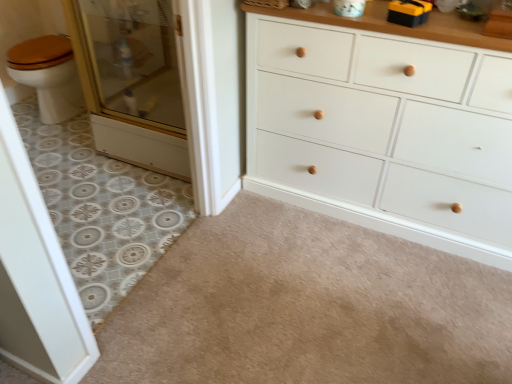
Question: Considering the relative sizes of white painted wood chest of drawers at center and beige carpet at lower center, positioned as the second plain in left-to-right order, in the image provided, is white painted wood chest of drawers at center smaller than beige carpet at lower center, positioned as the second plain in left-to-right order,?

Choices:
 (A) no
 (B) yes

Answer: (A)

Question: Can you confirm if white painted wood chest of drawers at center is thinner than beige carpet at lower center, positioned as the second plain in left-to-right order?

Choices:
 (A) no
 (B) yes

Answer: (B)

Question: Would you say white painted wood chest of drawers at center is outside beige carpet at lower center, positioned as the second plain in left-to-right order?

Choices:
 (A) yes
 (B) no

Answer: (A)

Question: Is white painted wood chest of drawers at center at the left side of beige carpet at lower center, positioned as the second plain in left-to-right order?

Choices:
 (A) yes
 (B) no

Answer: (B)

Question: Is white painted wood chest of drawers at center surrounding beige carpet at lower center, positioned as the first plain in right-to-left order?

Choices:
 (A) no
 (B) yes

Answer: (A)

Question: Visually, is clear glass screen door at left, marked as the 2th screen door in a top-to-bottom arrangement, positioned to the left or to the right of white painted wood chest of drawers at center?

Choices:
 (A) left
 (B) right

Answer: (A)

Question: From the image's perspective, is clear glass screen door at left, marked as the 2th screen door in a top-to-bottom arrangement, positioned above or below white painted wood chest of drawers at center?

Choices:
 (A) below
 (B) above

Answer: (A)

Question: In terms of width, does clear glass screen door at left, which is counted as the first screen door, starting from the bottom, look wider or thinner when compared to white painted wood chest of drawers at center?

Choices:
 (A) wide
 (B) thin

Answer: (B)

Question: Does point (30, 322) appear closer or farther from the camera than point (282, 26)?

Choices:
 (A) farther
 (B) closer

Answer: (B)

Question: Relative to white painted wood chest of drawers at center, is beige carpet at lower center, positioned as the second plain in left-to-right order, in front or behind?

Choices:
 (A) behind
 (B) front

Answer: (B)

Question: In terms of height, does beige carpet at lower center, positioned as the first plain in right-to-left order, look taller or shorter compared to white painted wood chest of drawers at center?

Choices:
 (A) tall
 (B) short

Answer: (B)

Question: Based on their sizes in the image, would you say beige carpet at lower center, positioned as the second plain in left-to-right order, is bigger or smaller than white painted wood chest of drawers at center?

Choices:
 (A) big
 (B) small

Answer: (B)

Question: From the image's perspective, is beige carpet at lower center, positioned as the second plain in left-to-right order, located above or below white painted wood chest of drawers at center?

Choices:
 (A) below
 (B) above

Answer: (A)

Question: Is point (73, 155) closer or farther from the camera than point (9, 289)?

Choices:
 (A) farther
 (B) closer

Answer: (A)

Question: In the image, is patterned tile floor at left, arranged as the second plain when viewed from the right, on the left side or the right side of clear glass screen door at left, acting as the 2th screen door starting from the back?

Choices:
 (A) right
 (B) left

Answer: (B)